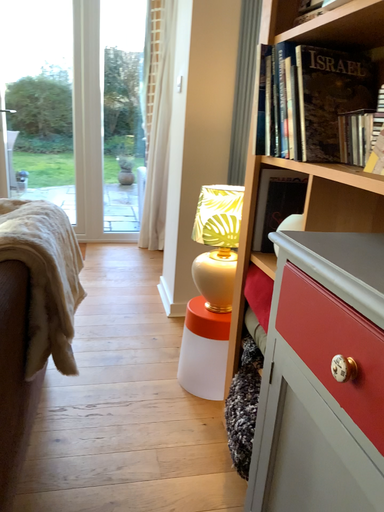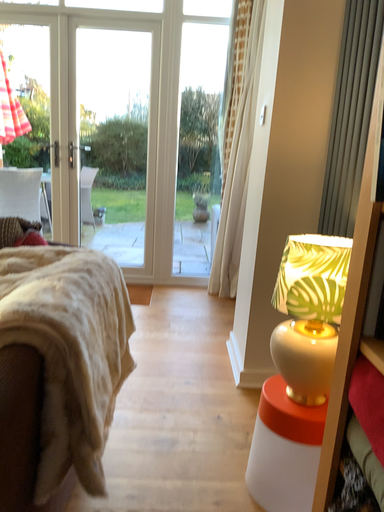
Question: How did the camera likely rotate when shooting the video?

Choices:
 (A) rotated left
 (B) rotated right

Answer: (A)